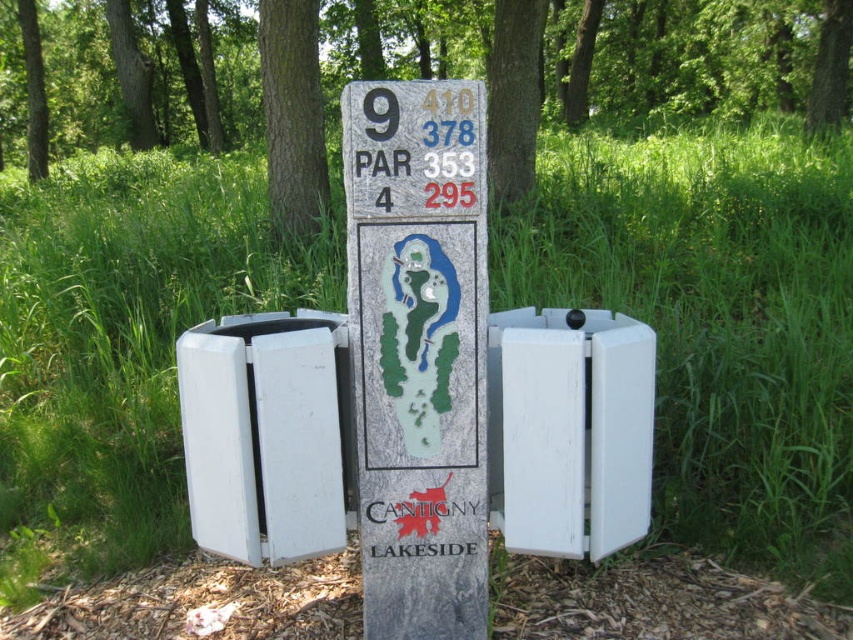
You are a golfer standing at the golf course marker and looking at the two trees in the image. Which tree, the green textured tree at upper center or the smooth bark tree at upper center, is positioned higher up in the image?

The green textured tree at upper center is positioned higher up in the image than the smooth bark tree at upper center.

You are standing in front of the golf course marker and want to touch both points on the marker. Which point should you reach for first, point (x=300, y=230) or point (x=468, y=493)?

You should reach for point (x=300, y=230) first because it is closer to you than point (x=468, y=493), which is further away.